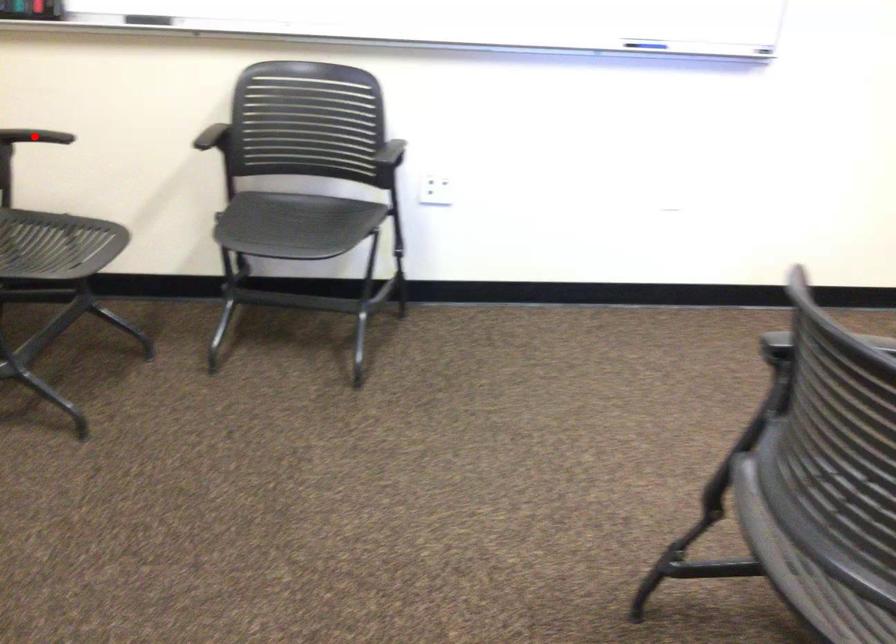
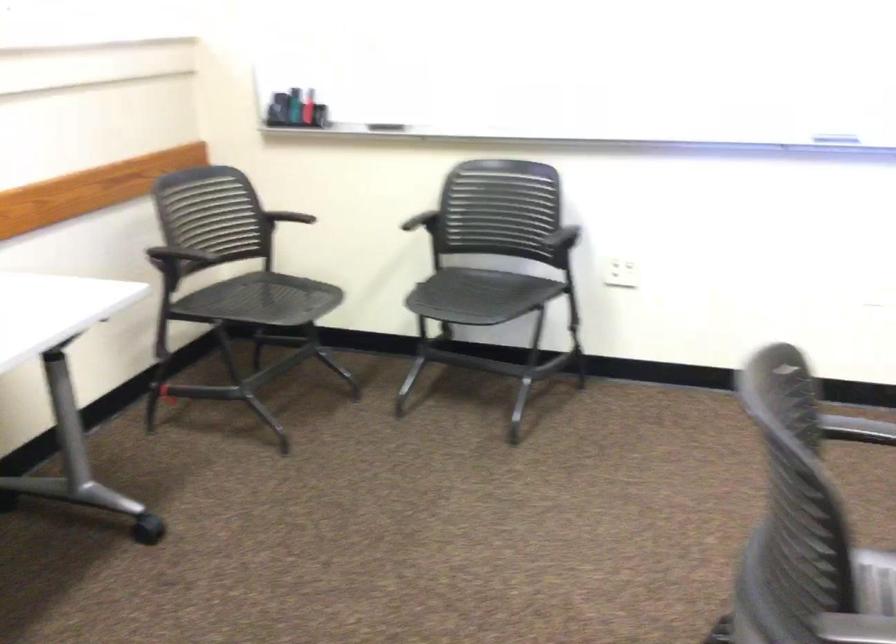
Question: I am providing you with two images of the same scene from different viewpoints. In image1, a red point is highlighted. Considering the same 3D point in image2, which of the following is correct?

Choices:
 (A) It is closer
 (B) It is farther

Answer: (B)